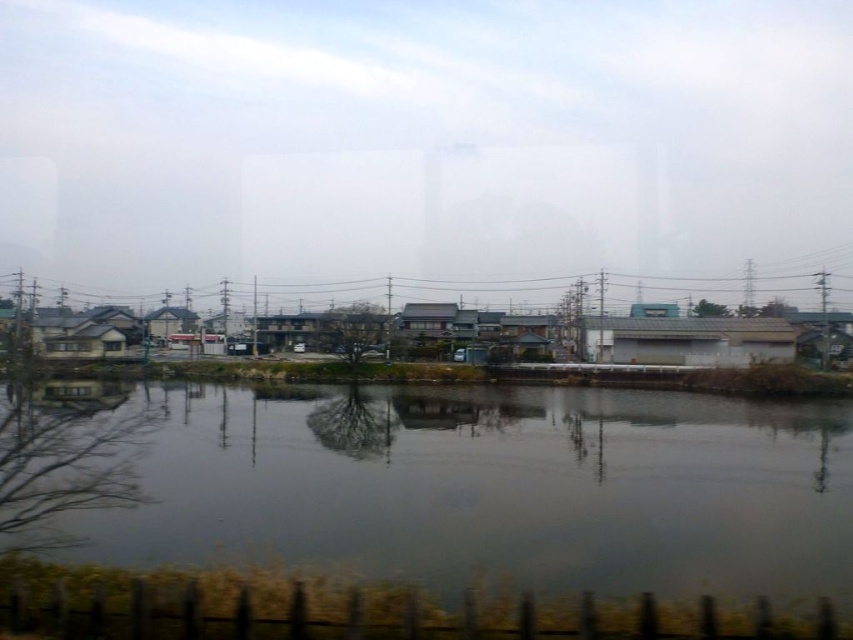
Question: Is dark gray water at center wider than green corrugated metal power line at center?

Choices:
 (A) yes
 (B) no

Answer: (B)

Question: Does dark gray water at center appear on the right side of green corrugated metal power line at center?

Choices:
 (A) no
 (B) yes

Answer: (B)

Question: Which object appears closest to the camera in this image?

Choices:
 (A) dark gray water at center
 (B) green corrugated metal power line at center

Answer: (A)

Question: Is dark gray water at center positioned before green corrugated metal power line at center?

Choices:
 (A) no
 (B) yes

Answer: (B)

Question: Which point is farther from the camera taking this photo?

Choices:
 (A) (738, 461)
 (B) (351, 285)

Answer: (B)

Question: Which point appears farthest from the camera in this image?

Choices:
 (A) (299, 289)
 (B) (546, 426)

Answer: (A)